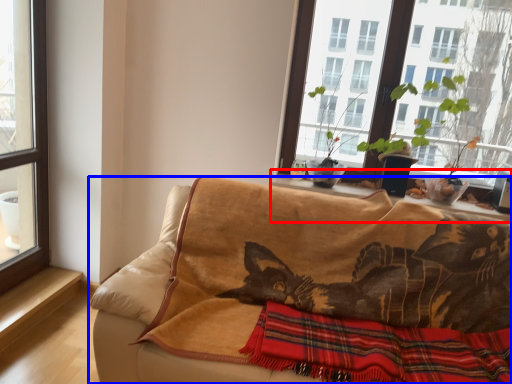
Question: Among these objects, which one is nearest to the camera, window sill (highlighted by a red box) or studio couch (highlighted by a blue box)?

Choices:
 (A) window sill
 (B) studio couch

Answer: (B)